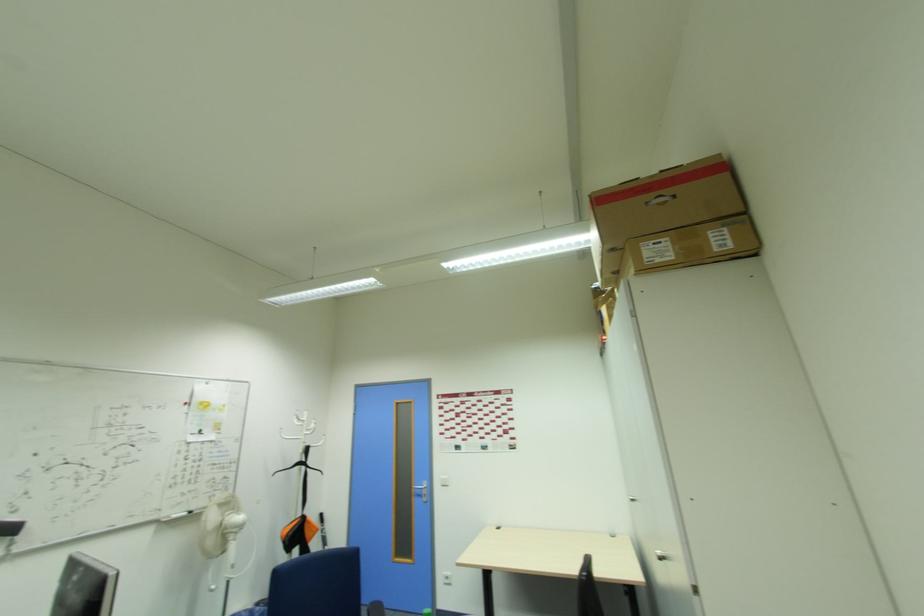
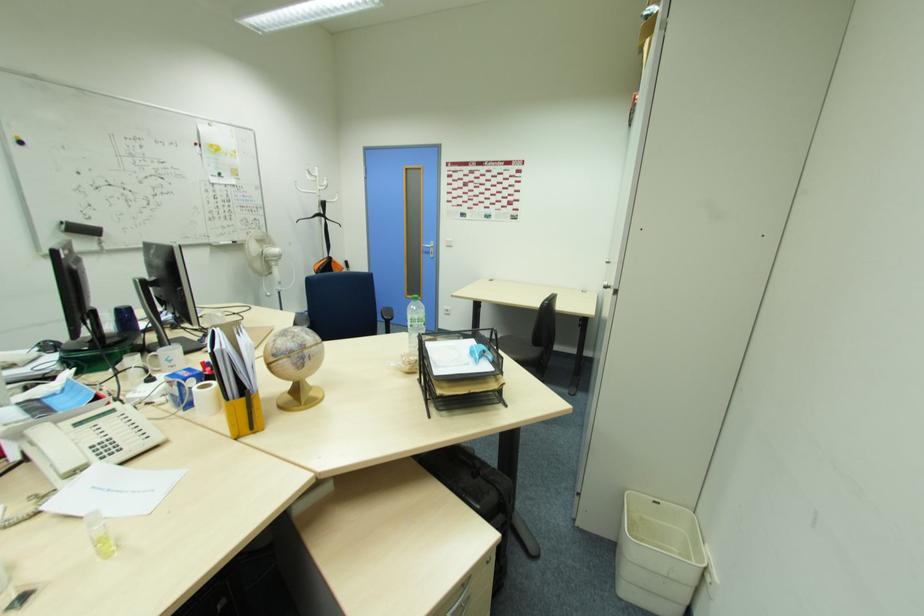
Where in the second image is the point corresponding to [663,554] from the first image?

(608, 280)